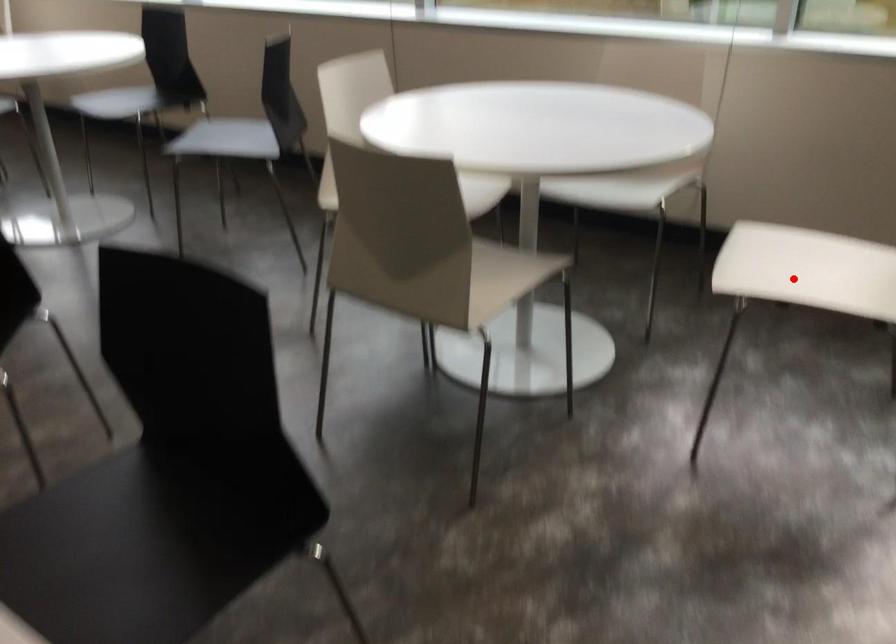
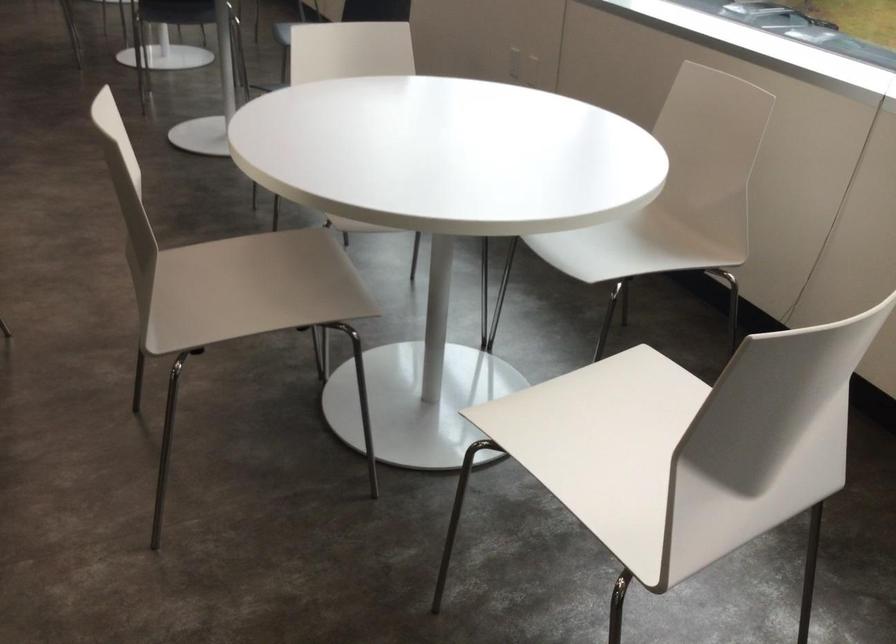
Locate, in the second image, the point that corresponds to the highlighted location in the first image.

(604, 444)